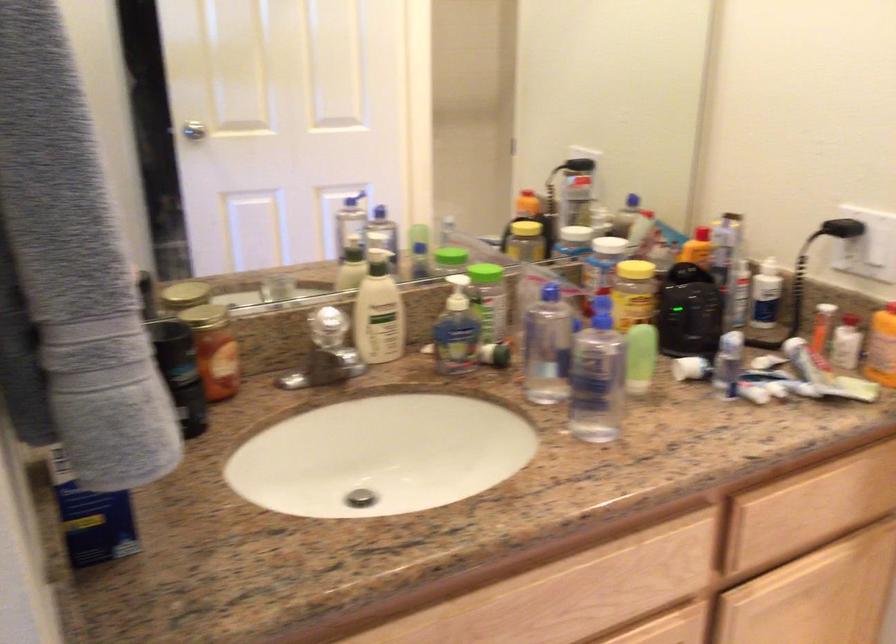
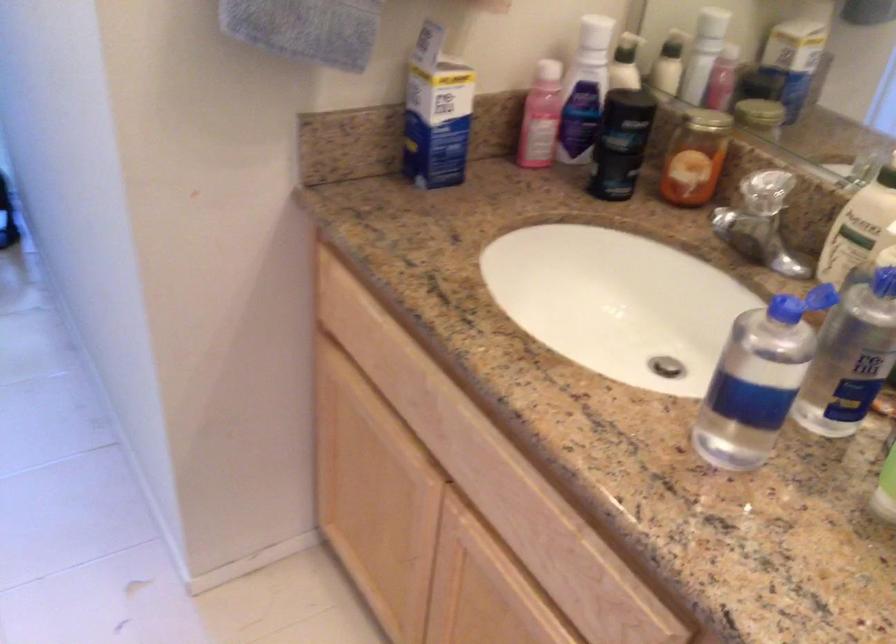
How did the camera likely rotate?

The camera rotated toward left-down.